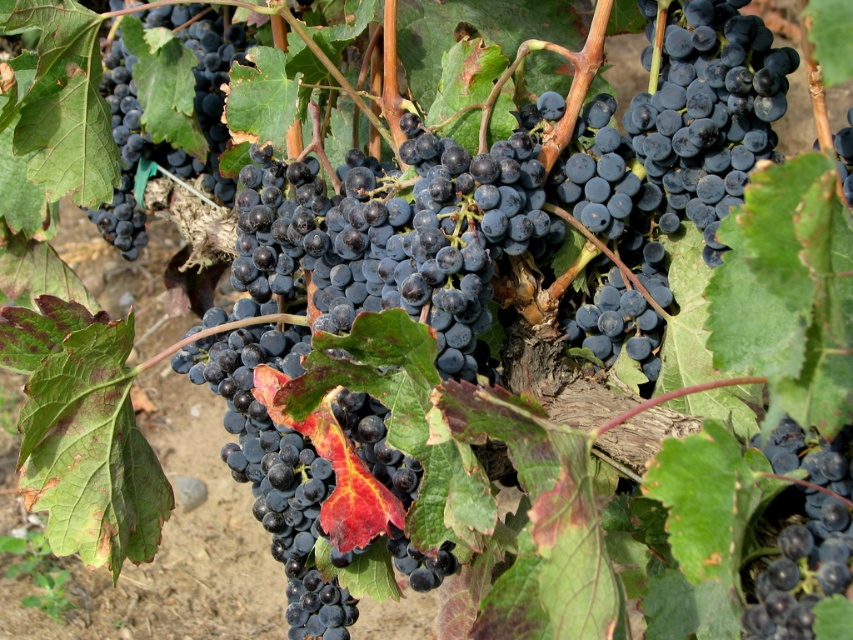
You are a fruit inspector checking the grapes in the vineyard. You notice a point in the image at coordinates (804, 534). What type of grapes are located at that point?

At point (804, 534) lies shiny dark blue grapes at center.

You are a fruit inspector checking the grapes. You need to locate the shiny dark blue grapes at upper left. Where exactly are they located in the image?

The shiny dark blue grapes at upper left are located at point (155,108) in the image.